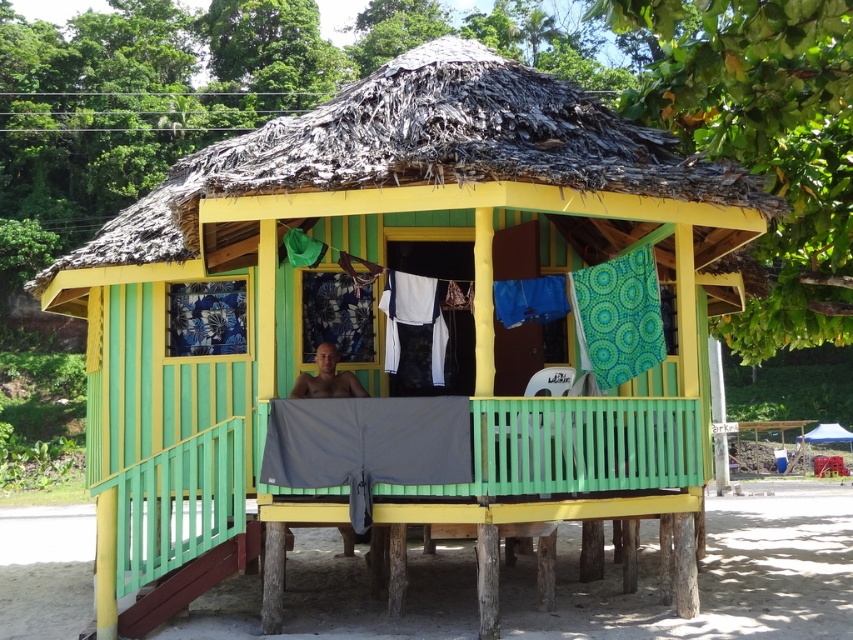
Question: Which point is farther from the camera taking this photo?

Choices:
 (A) click(x=837, y=433)
 (B) click(x=335, y=396)

Answer: (A)

Question: Is smooth skin man at center positioned behind blue fabric canopy at upper right?

Choices:
 (A) no
 (B) yes

Answer: (A)

Question: Which of the following is the closest to the observer?

Choices:
 (A) (802, 438)
 (B) (325, 390)

Answer: (B)

Question: Does smooth skin man at center have a smaller size compared to blue fabric canopy at upper right?

Choices:
 (A) no
 (B) yes

Answer: (B)

Question: Does smooth skin man at center appear on the right side of blue fabric canopy at upper right?

Choices:
 (A) yes
 (B) no

Answer: (B)